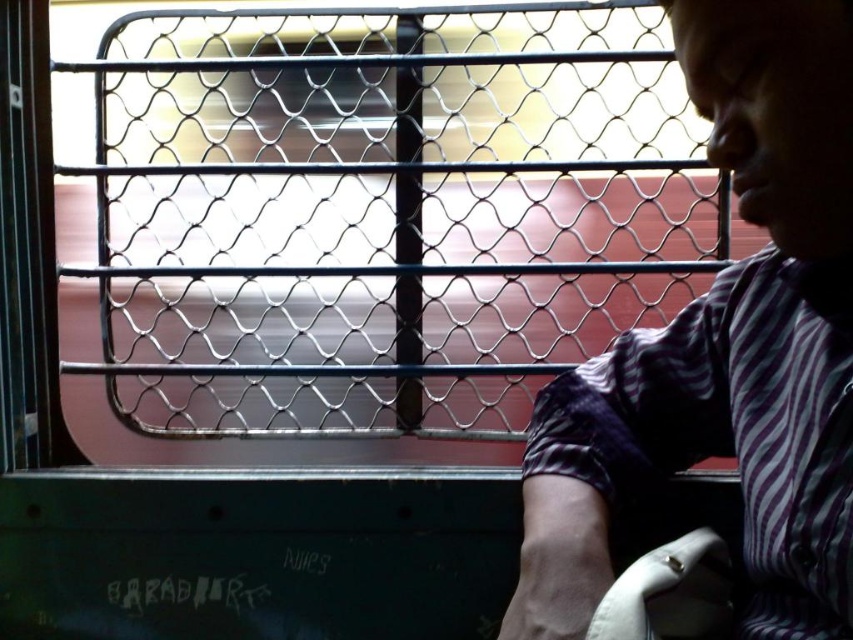
Which is in front, point (384, 410) or point (838, 20)?

Point (838, 20) is in front.

Is metallic mesh at center further to the viewer compared to purple striped shirt at right?

Yes.

I want to click on metallic mesh at center, so (368, 225).